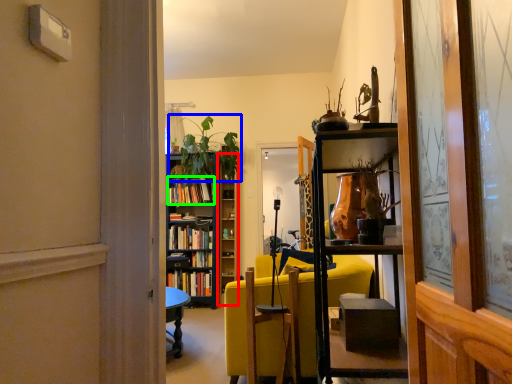
Question: Estimate the real-world distances between objects in this image. Which object is farther from bookshelf (highlighted by a red box), houseplant (highlighted by a blue box) or book (highlighted by a green box)?

Choices:
 (A) houseplant
 (B) book

Answer: (B)